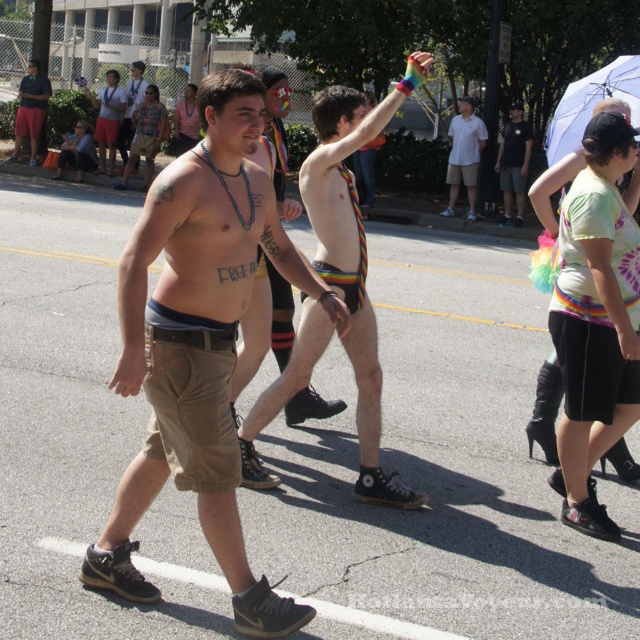
Based on the photo, does matte black shorts at upper left appear over matte black shorts at center?

Actually, matte black shorts at upper left is below matte black shorts at center.

Does point (29, 61) come farther from viewer compared to point (141, 84)?

Yes, point (29, 61) is farther from viewer.

Does point (33, 118) lie behind point (131, 86)?

No, it is not.

At what (x,y) coordinates should I click in order to perform the action: click on matte black shorts at upper left. Please return your answer as a coordinate pair (x, y). Looking at the image, I should click on (29, 109).

Is rainbow striped underwear at center positioned at the back of white cotton shirt at center?

That is False.

Can you confirm if rainbow striped underwear at center is positioned below white cotton shirt at center?

Yes.

Image resolution: width=640 pixels, height=640 pixels. I want to click on rainbow striped underwear at center, so click(x=355, y=256).

Is point (314, 100) farther from camera compared to point (509, 188)?

No, (314, 100) is closer to viewer.

What are the coordinates of `rainbow striped underwear at center` in the screenshot? It's located at (355, 256).

The width and height of the screenshot is (640, 640). In order to click on rainbow striped underwear at center in this screenshot , I will do `click(355, 256)`.